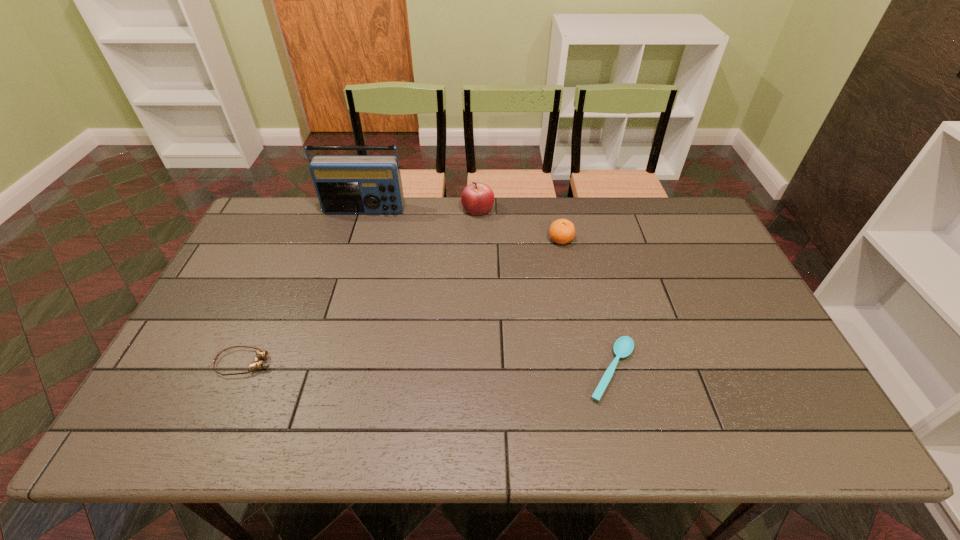
Locate an element on the screen. The height and width of the screenshot is (540, 960). vacant space located 0.130m on the front lenses and sides of the goggles is located at coordinates (325, 363).

At what (x,y) coordinates should I click in order to perform the action: click on vacant space located 0.070m on the right of the spoon. Please return your answer as a coordinate pair (x, y). This screenshot has width=960, height=540. Looking at the image, I should click on (x=668, y=370).

Where is `radio receiver present at the far edge`? Image resolution: width=960 pixels, height=540 pixels. radio receiver present at the far edge is located at coordinates (345, 184).

The image size is (960, 540). I want to click on apple present at the far edge, so click(477, 198).

Locate an element on the screen. clementine that is positioned at the far edge is located at coordinates (562, 231).

You are a GUI agent. You are given a task and a screenshot of the screen. Output one action in this format:
    pyautogui.click(x=<x>, y=<y>)
    Task: Click on the object that is at the left edge
    The height and width of the screenshot is (540, 960).
    Given the screenshot: What is the action you would take?
    pyautogui.click(x=260, y=354)

Image resolution: width=960 pixels, height=540 pixels. Identify the location of free region at the far edge of the desktop. (662, 239).

The height and width of the screenshot is (540, 960). In the image, there is a desktop. Find the location of `free space at the near edge`. free space at the near edge is located at coordinates (559, 423).

The width and height of the screenshot is (960, 540). I want to click on free region at the left edge of the desktop, so click(x=274, y=254).

This screenshot has height=540, width=960. Identify the location of blank area at the right edge. (744, 333).